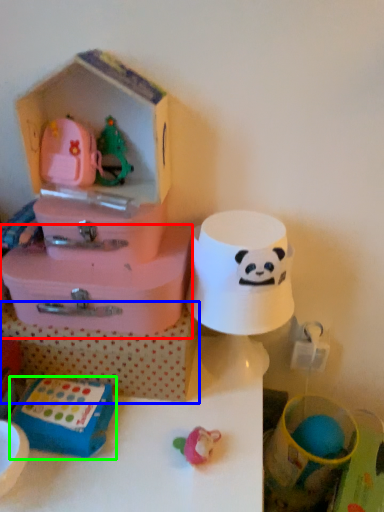
Question: Estimate the real-world distances between objects in this image. Which object is farther from storage box (highlighted by a red box), storage box (highlighted by a blue box) or toy (highlighted by a green box)?

Choices:
 (A) storage box
 (B) toy

Answer: (B)